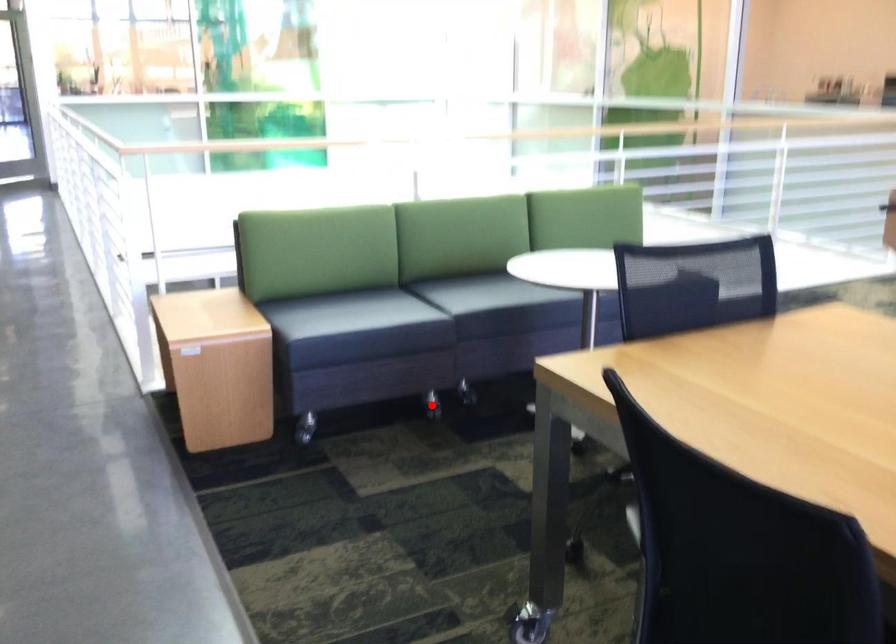
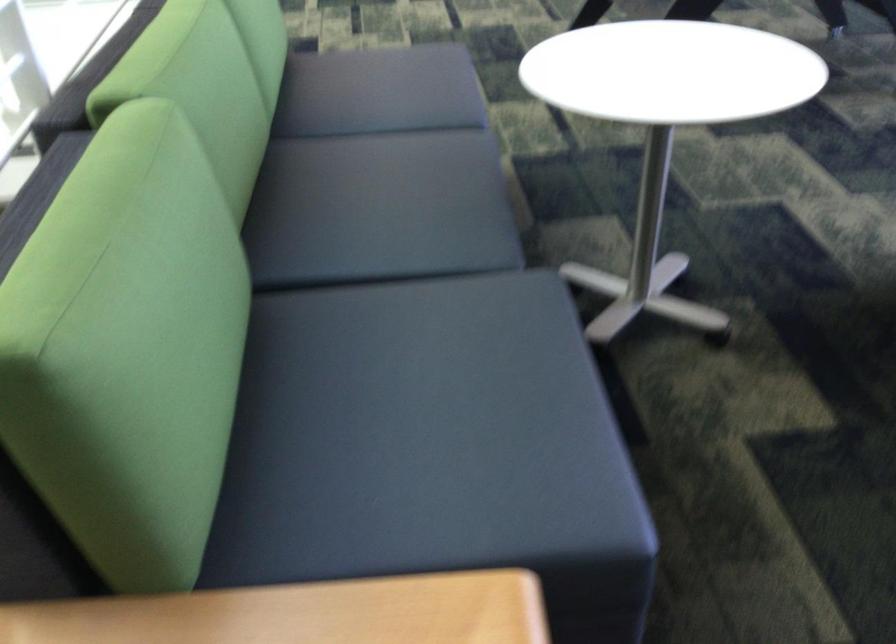
Question: I am providing you with two images of the same scene from different viewpoints. A red point is marked on the first image. At the location where the point appears in image 1, is it still visible in image 2?

Choices:
 (A) Yes
 (B) No

Answer: (B)